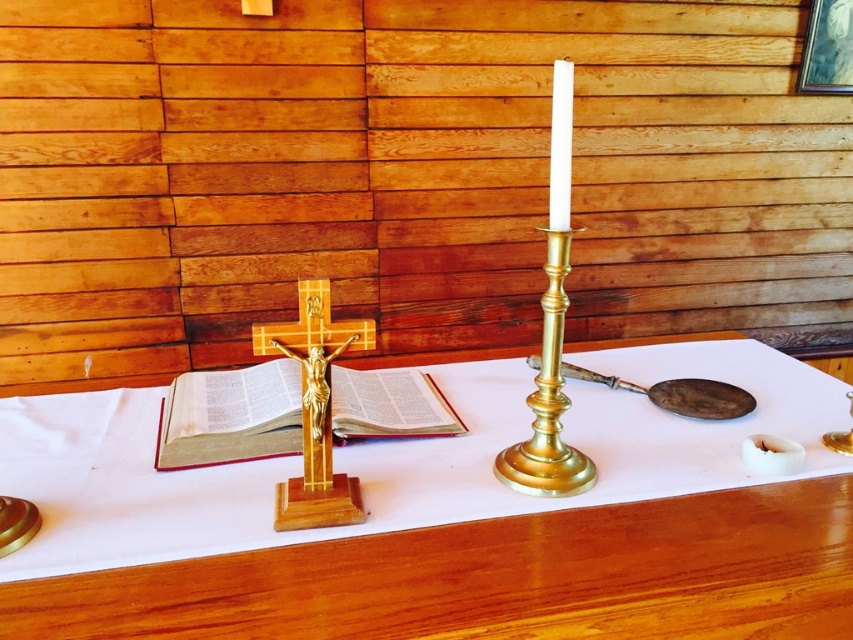
You are standing in front of the altar and want to place a small flower vase on the white cloth at center. If your hand is 24 inches away from the cloth, will you be able to reach it without moving closer?

The white cloth at center is 23.11 inches away from the camera. Since your hand is 24 inches away, you are slightly farther than the cloth, so you might need to move a tiny bit closer to reach it comfortably.